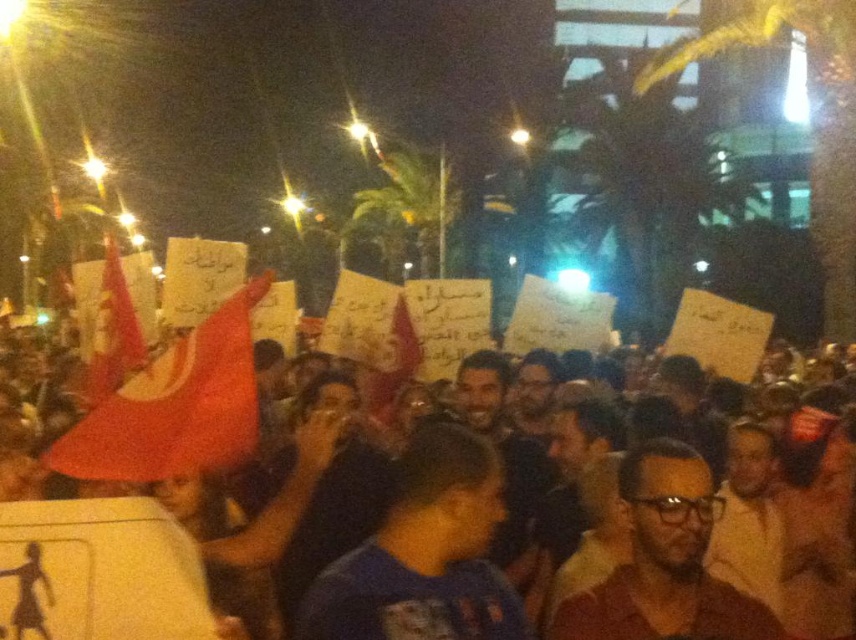
You are a photographer trying to capture the red fabric flags at center in the nighttime scene. The camera you are using has a limited field of view and can only focus on objects within a specific coordinate range. Given that the coordinate system starts at the bottom left corner of the image, with the origin at 0.0, 0.0 and maximum coordinates at 1.0, 1.0, can you confirm if the point you are aiming at, point [137,556], is indeed where the red fabric flags at center are located?

Yes, the point [137,556] corresponds to the red fabric flags at center, so aiming at that coordinate will capture them.

You are organizing a protest and need to choose between two red fabric flags to place at the front of the crowd. The red fabric flags at center and the red fabric flag at left are available. Based on their sizes, which flag should you choose to ensure it is more visible from a distance?

The red fabric flag at left should be chosen because its width is larger than the red fabric flags at center, making it more visible from a distance.